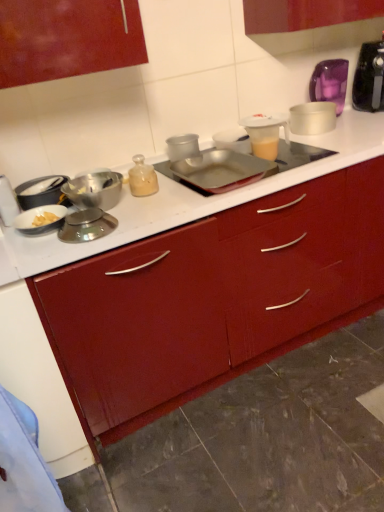
The image size is (384, 512). What are the coordinates of `free spot above metallic silver scale at center-left, which is the 3th kitchen appliance from right to left (from a real-world perspective)` in the screenshot? It's located at (86, 215).